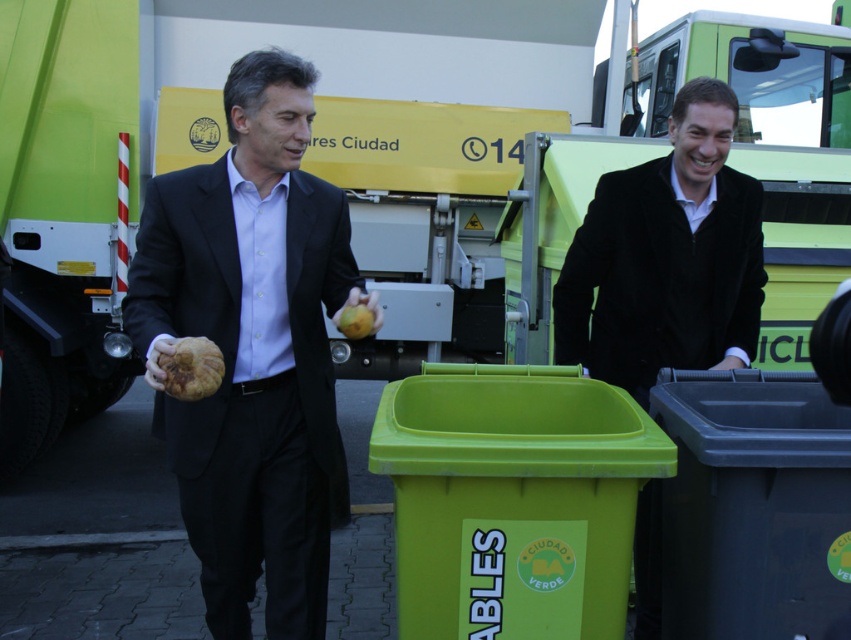
Question: Where is black velvet suit at right located in relation to smooth yellow fruit at center in the image?

Choices:
 (A) above
 (B) below

Answer: (A)

Question: Which point is closer to the camera taking this photo?

Choices:
 (A) (591, 340)
 (B) (213, 353)
 (C) (181, 470)
 (D) (694, 356)

Answer: (B)

Question: Which of the following is the closest to the observer?

Choices:
 (A) (478, 460)
 (B) (363, 310)
 (C) (172, 440)
 (D) (564, 320)

Answer: (A)

Question: Is green plastic bin at center thinner than velvet black jacket at right?

Choices:
 (A) no
 (B) yes

Answer: (A)

Question: Observing the image, what is the correct spatial positioning of black velvet suit at right in reference to smooth yellow fruit at center?

Choices:
 (A) below
 (B) above

Answer: (B)

Question: Estimate the real-world distances between objects in this image. Which object is closer to the rotten brown fruit at lower left?

Choices:
 (A) velvet black jacket at right
 (B) green plastic bin at center

Answer: (B)